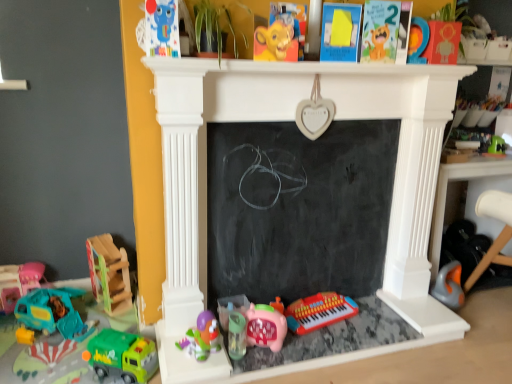
Question: Is pink matte piggy bank at center, which is the fifth toy in right-to-left order, next to translucent plastic sippy cup at lower center, which is the seventh toy from left to right, and touching it?

Choices:
 (A) no
 (B) yes

Answer: (B)

Question: Is pink matte piggy bank at center, the eighth toy in the left-to-right sequence, to the right of translucent plastic sippy cup at lower center, the sixth toy from the right, from the viewer's perspective?

Choices:
 (A) no
 (B) yes

Answer: (B)

Question: From a real-world perspective, is pink matte piggy bank at center, the eighth toy in the left-to-right sequence, located beneath translucent plastic sippy cup at lower center, which is the seventh toy from left to right?

Choices:
 (A) no
 (B) yes

Answer: (A)

Question: Is pink matte piggy bank at center, which is the fifth toy in right-to-left order, at the left side of translucent plastic sippy cup at lower center, the sixth toy from the right?

Choices:
 (A) yes
 (B) no

Answer: (B)

Question: From the image's perspective, does pink matte piggy bank at center, the eighth toy in the left-to-right sequence, appear higher than translucent plastic sippy cup at lower center, the sixth toy from the right?

Choices:
 (A) no
 (B) yes

Answer: (B)

Question: Considering the relative positions of wooden rocking horse at left, the third toy from the left, and plastic red keyboard at lower center, the ninth toy positioned from the left, in the image provided, is wooden rocking horse at left, the third toy from the left, to the left or to the right of plastic red keyboard at lower center, the ninth toy positioned from the left,?

Choices:
 (A) left
 (B) right

Answer: (A)

Question: In terms of width, does wooden rocking horse at left, the third toy from the left, look wider or thinner when compared to plastic red keyboard at lower center, the ninth toy positioned from the left?

Choices:
 (A) wide
 (B) thin

Answer: (A)

Question: Is wooden rocking horse at left, the tenth toy in the right-to-left sequence, bigger or smaller than plastic red keyboard at lower center, which ranks as the 4th toy in right-to-left order?

Choices:
 (A) big
 (B) small

Answer: (A)

Question: Is point (89, 271) closer or farther from the camera than point (345, 317)?

Choices:
 (A) farther
 (B) closer

Answer: (A)

Question: From a real-world perspective, is teal plastic toy car at lower left, the second toy from the left, positioned above or below matte plastic toy at upper left, arranged as the fifth toy when viewed from the left?

Choices:
 (A) below
 (B) above

Answer: (A)

Question: In the image, is teal plastic toy car at lower left, placed as the 11th toy when sorted from right to left, positioned in front of or behind matte plastic toy at upper left, which appears as the eighth toy when viewed from the right?

Choices:
 (A) front
 (B) behind

Answer: (B)

Question: Would you say teal plastic toy car at lower left, placed as the 11th toy when sorted from right to left, is inside or outside matte plastic toy at upper left, which appears as the eighth toy when viewed from the right?

Choices:
 (A) inside
 (B) outside

Answer: (B)

Question: From the image's perspective, relative to matte plastic toy at upper left, arranged as the fifth toy when viewed from the left, is teal plastic toy car at lower left, the second toy from the left, above or below?

Choices:
 (A) above
 (B) below

Answer: (B)

Question: In the image, is pink matte piggy bank at center, which is the fifth toy in right-to-left order, on the left side or the right side of matte orange wooden number at upper right, marked as the eleventh toy in a left-to-right arrangement?

Choices:
 (A) right
 (B) left

Answer: (B)

Question: Considering the positions of point (257, 309) and point (438, 44), is point (257, 309) closer or farther from the camera than point (438, 44)?

Choices:
 (A) closer
 (B) farther

Answer: (B)